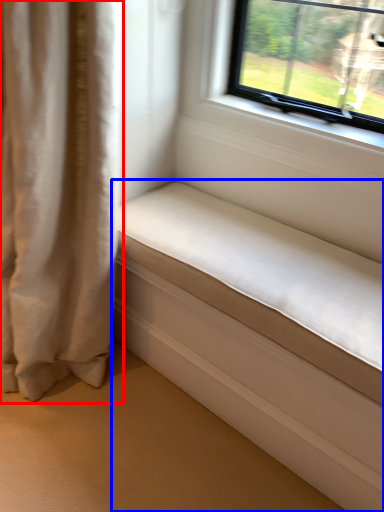
Question: Which object appears closest to the camera in this image, curtain (highlighted by a red box) or studio couch (highlighted by a blue box)?

Choices:
 (A) curtain
 (B) studio couch

Answer: (A)